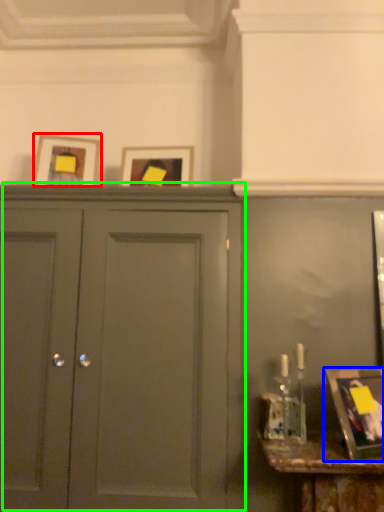
Question: Considering the real-world distances, which object is farthest from picture frame (highlighted by a red box)? picture frame (highlighted by a blue box) or door (highlighted by a green box)?

Choices:
 (A) picture frame
 (B) door

Answer: (A)